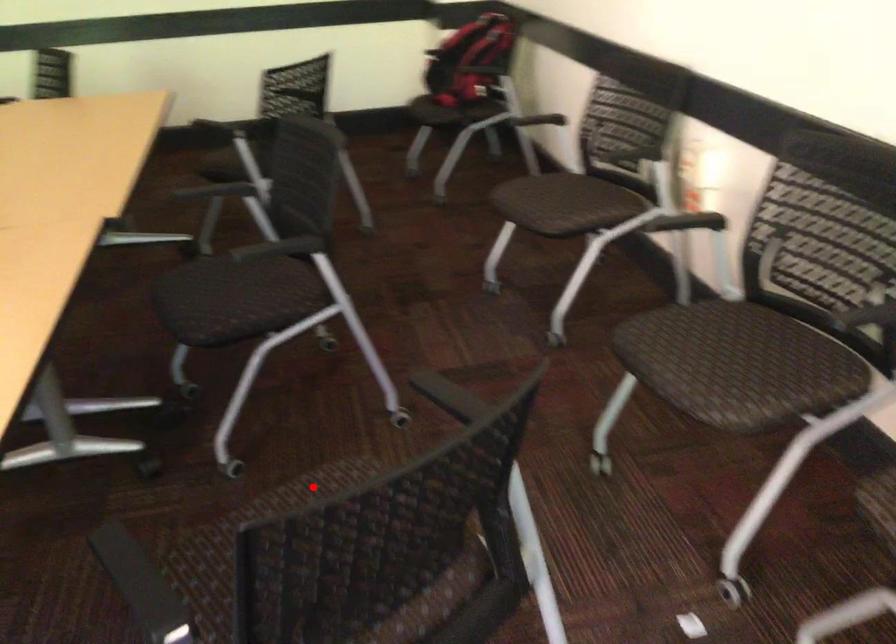
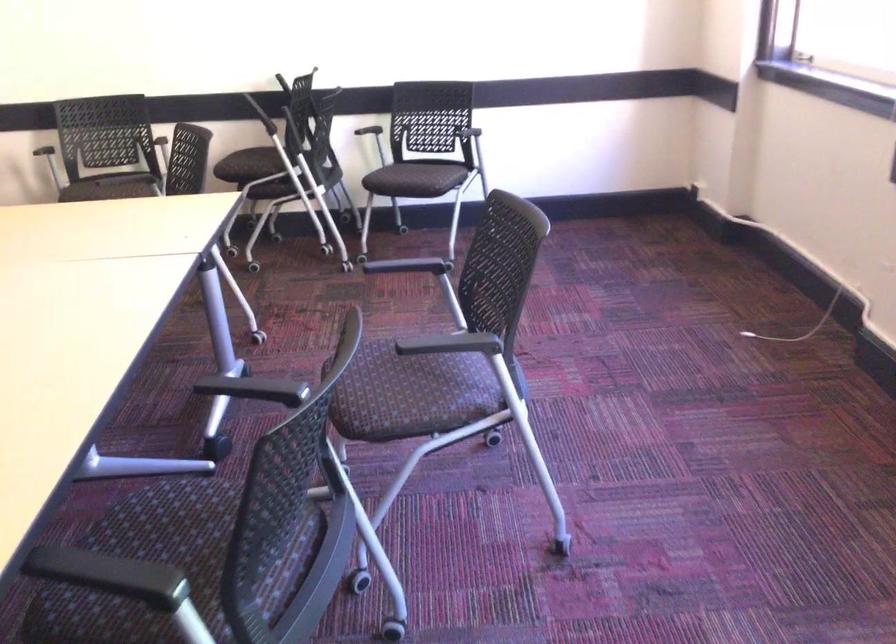
Question: I am providing you with two images of the same scene from different viewpoints. A red point is marked on the first image. At the location where the point appears in image 1, is it still visible in image 2?

Choices:
 (A) Yes
 (B) No

Answer: (B)